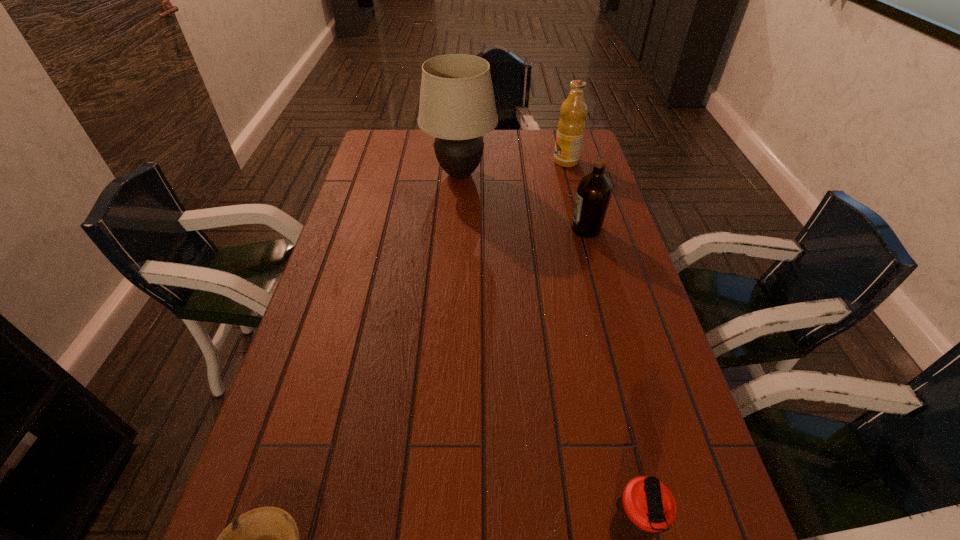
The height and width of the screenshot is (540, 960). What are the coordinates of `empty space that is in between the taller olive oil and the lampshade` in the screenshot? It's located at (514, 167).

The width and height of the screenshot is (960, 540). What are the coordinates of `empty location between the taller olive oil and the lampshade` in the screenshot? It's located at (514, 167).

The image size is (960, 540). What are the coordinates of `vacant point located between the second object from left to right and the third nearest object` in the screenshot? It's located at pyautogui.click(x=523, y=202).

Where is `object that can be found as the closest to the taller olive oil`? object that can be found as the closest to the taller olive oil is located at coordinates (457, 106).

In order to click on object that can be found as the second closest to the second object from left to right in this screenshot , I will do `click(593, 193)`.

Locate an element on the screen. The image size is (960, 540). vacant area that satisfies the following two spatial constraints: 1. on the label of the second tallest object; 2. on the front side of the fourth object from right to left is located at coordinates (570, 174).